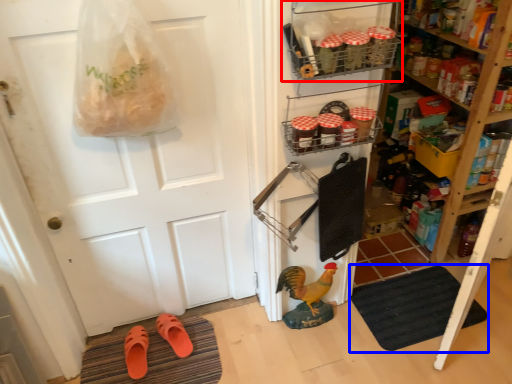
Question: Among these objects, which one is nearest to the camera, shelf (highlighted by a red box) or doormat (highlighted by a blue box)?

Choices:
 (A) shelf
 (B) doormat

Answer: (A)